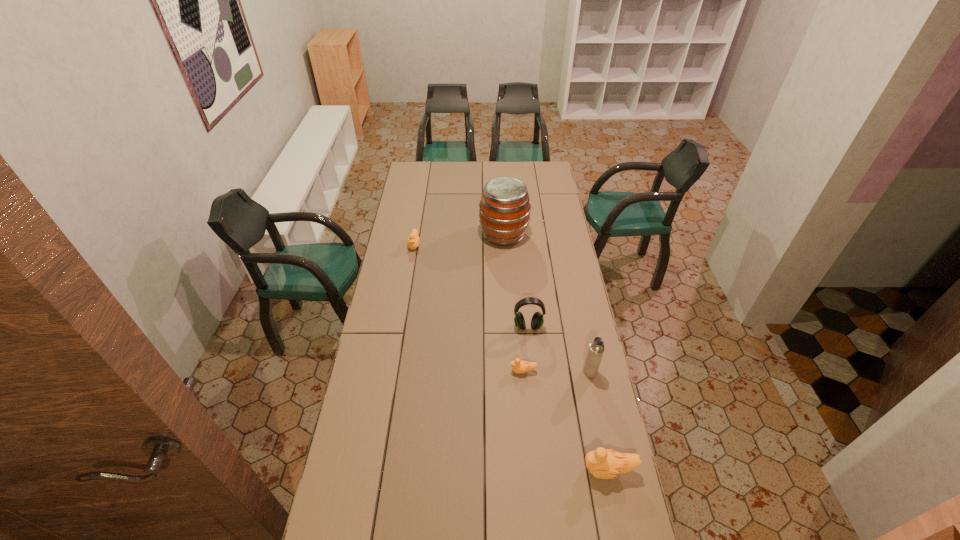
I want to click on spot to insert another duckling for uniform distribution, so click(462, 299).